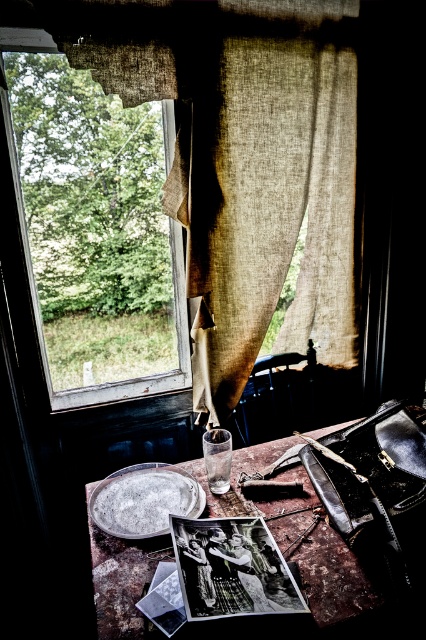
Who is positioned more to the right, transparent glass window at upper left or silver metallic plate at center?

Positioned to the right is silver metallic plate at center.

Between transparent glass window at upper left and silver metallic plate at center, which one has less height?

silver metallic plate at center is shorter.

You are a GUI agent. You are given a task and a screenshot of the screen. Output one action in this format:
    pyautogui.click(x=<x>, y=<y>)
    Task: Click on the transparent glass window at upper left
    
    Given the screenshot: What is the action you would take?
    pyautogui.click(x=94, y=228)

Looking at this image, who is positioned more to the left, burlap curtain at upper left or transparent glass window at upper left?

transparent glass window at upper left is more to the left.

Is burlap curtain at upper left closer to camera compared to transparent glass window at upper left?

Yes, burlap curtain at upper left is closer to the viewer.

Does point (275, 132) come behind point (11, 131)?

Yes, point (275, 132) is farther from viewer.

In order to click on burlap curtain at upper left in this screenshot , I will do `click(244, 163)`.

Does point (238, 208) lie behind point (140, 532)?

That is True.

Describe the element at coordinates (244, 163) in the screenshot. I see `burlap curtain at upper left` at that location.

Is point (123, 90) closer to viewer compared to point (146, 481)?

No, (123, 90) is behind (146, 481).

This screenshot has width=426, height=640. I want to click on burlap curtain at upper left, so click(x=244, y=163).